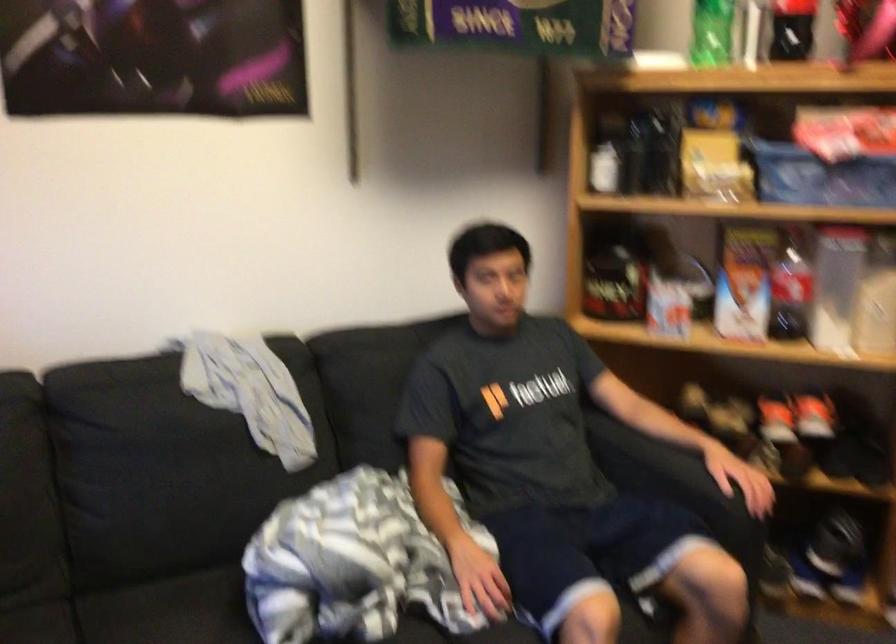
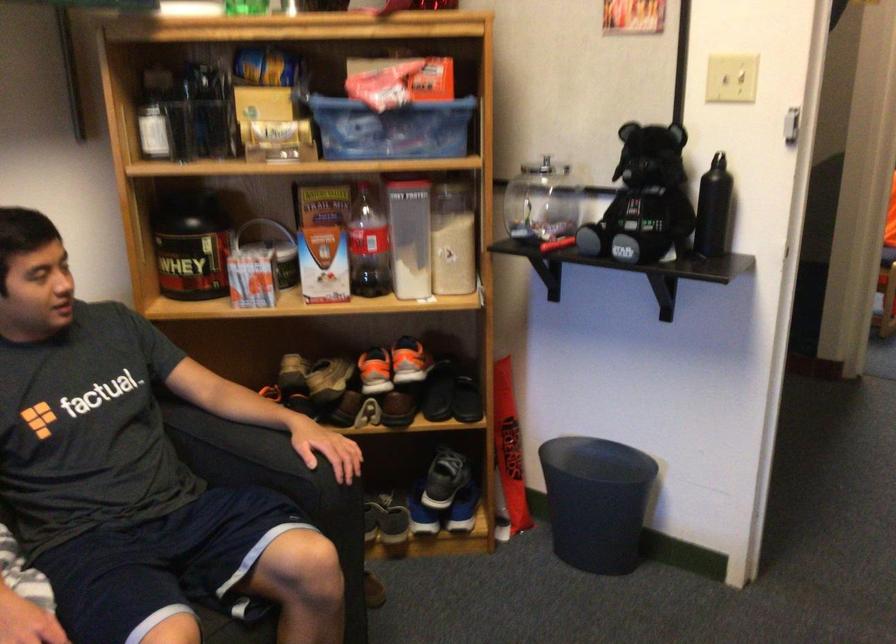
Find the pixel in the second image that matches point (789, 289) in the first image.

(367, 245)